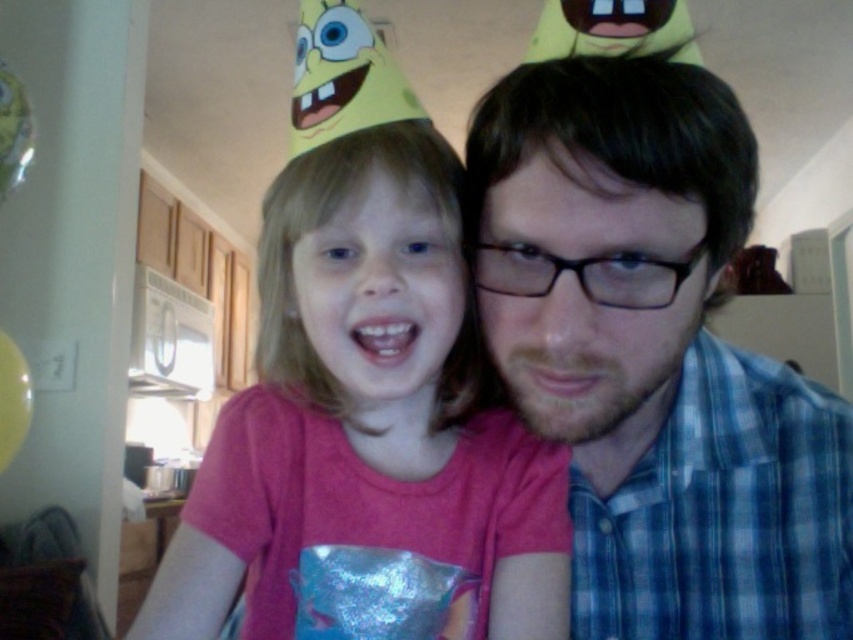
What object is located at the coordinates point (656, 356)?

The point (656, 356) corresponds to the blue plaid shirt at center.

You are designing a photo frame that needs to include both the blue plaid shirt at center and the pink matte shirt at center. The frame has a width of 4 inches. Will both shirts fit within the frame without overlapping?

The blue plaid shirt at center and pink matte shirt at center are 4.62 inches apart from each other, which is wider than the frame width of 4 inches. Therefore, the shirts will not fit within the frame without overlapping.